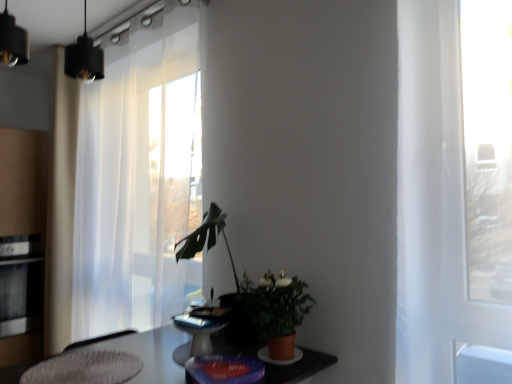
Where is `vacant space situated above textured gray rug at lower left (from a real-world perspective)`? The image size is (512, 384). vacant space situated above textured gray rug at lower left (from a real-world perspective) is located at coordinates (86, 361).